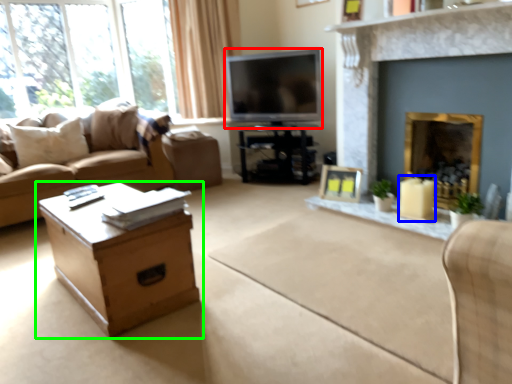
Question: Which object is the farthest from television (highlighted by a red box)? Choose among these: candle holder (highlighted by a blue box) or table (highlighted by a green box).

Choices:
 (A) candle holder
 (B) table

Answer: (B)